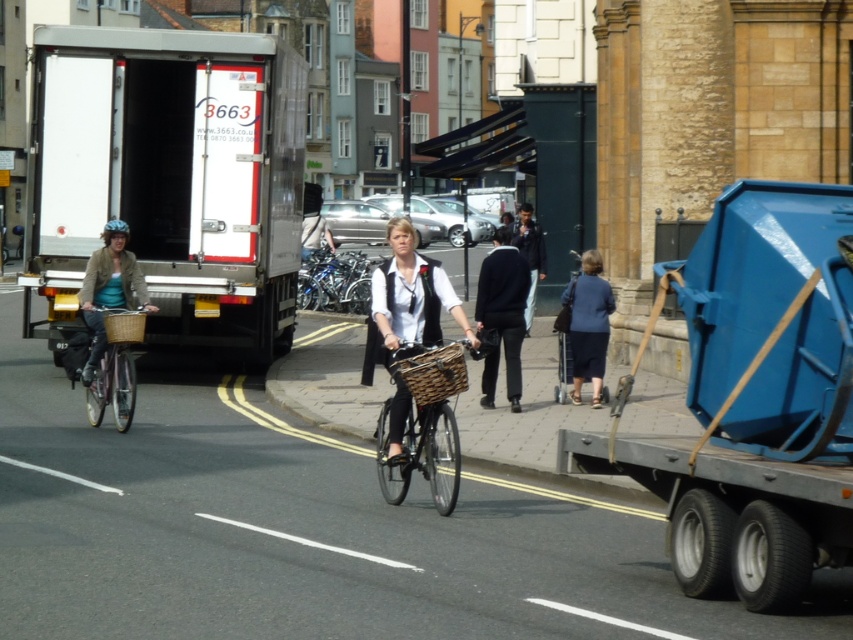
You are a delivery person who needs to choose between placing a package in either the dark blue sweater at center or the woven brown basket at left. Based on their sizes, which one can hold the package better?

The dark blue sweater at center is larger in size than the woven brown basket at left, so it can hold the package better.

You are a delivery person trying to decide which item to place first in your truck. The dark blue sweater at center and the woven brown basket at left are both items you need to load. Based on their sizes, which item should you load first to maximize space efficiency?

The dark blue sweater at center is wider than the woven brown basket at left, so you should load the wider dark blue sweater at center first to maximize space efficiency.